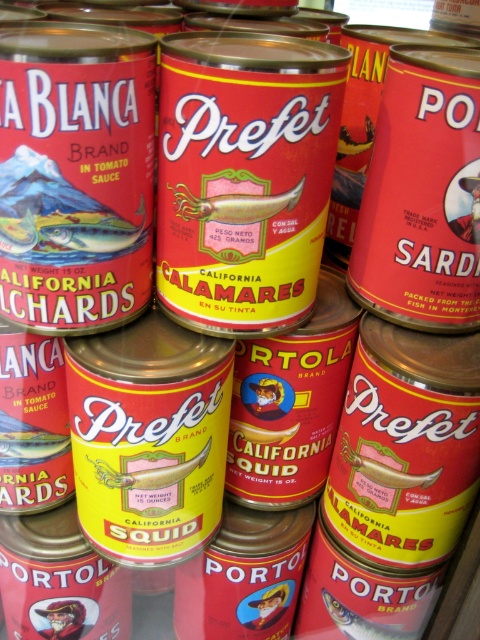
You are standing in front of a shelf with canned seafood products. There are two cans labeled with different seafood types. The first can is labeled as Prefet at point (247, 209) and the second can is labeled as Portola at point 0.672, 0.515. You want to grab both cans but need to know if they are within arm reach. Your arms can reach 34 inches. Are these two cans within your reach?

The distance between the two cans is 33.76 inches, which is just under your 34 inch reach. Yes, you can grab both cans as they are within arm reach.

You are a store employee arranging cans on a shelf. You have two cans to place side by side. The yellow matte squid at center and the shiny silver fish at center. Which can should you place first if you want the thinner can to be on the left?

You should place the yellow matte squid at center first on the left since it is thinner than the shiny silver fish at center.

You are a customer in a store looking at the canned seafood shelf. You see the yellow matte squid at center and the shiny silver fish at center. Which one is positioned more to the left?

The yellow matte squid at center is positioned more to the left than the shiny silver fish at center.